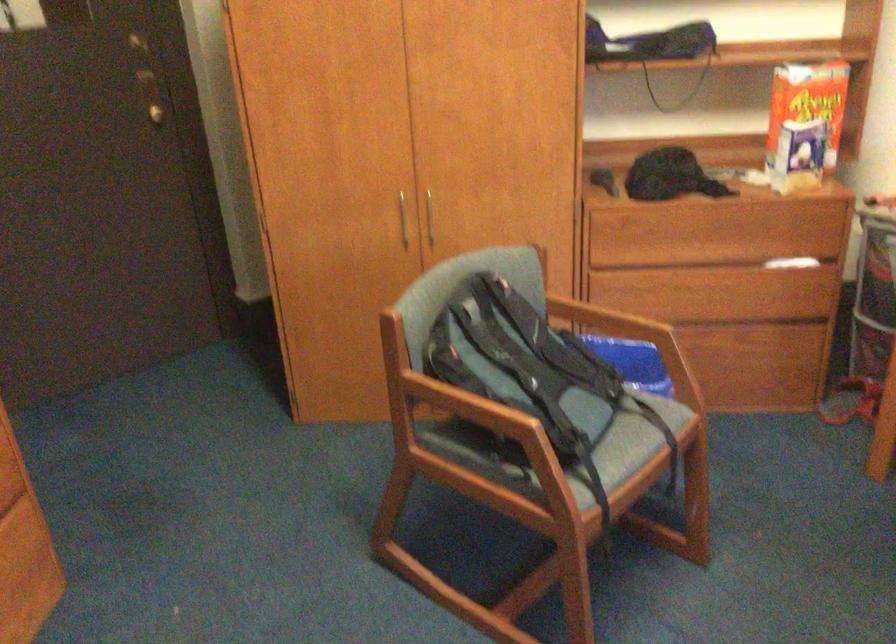
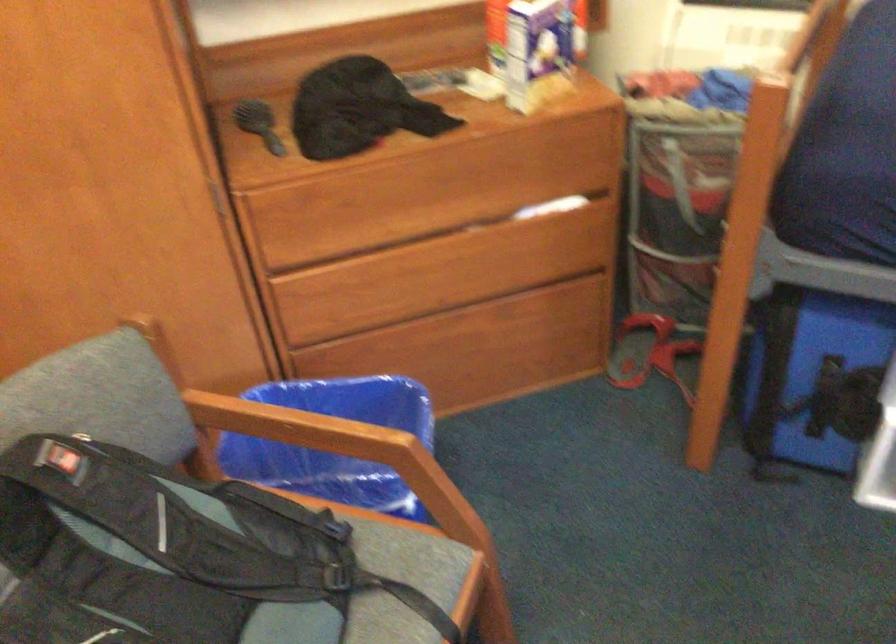
The point at (621, 393) is marked in the first image. Where is the corresponding point in the second image?

(352, 514)